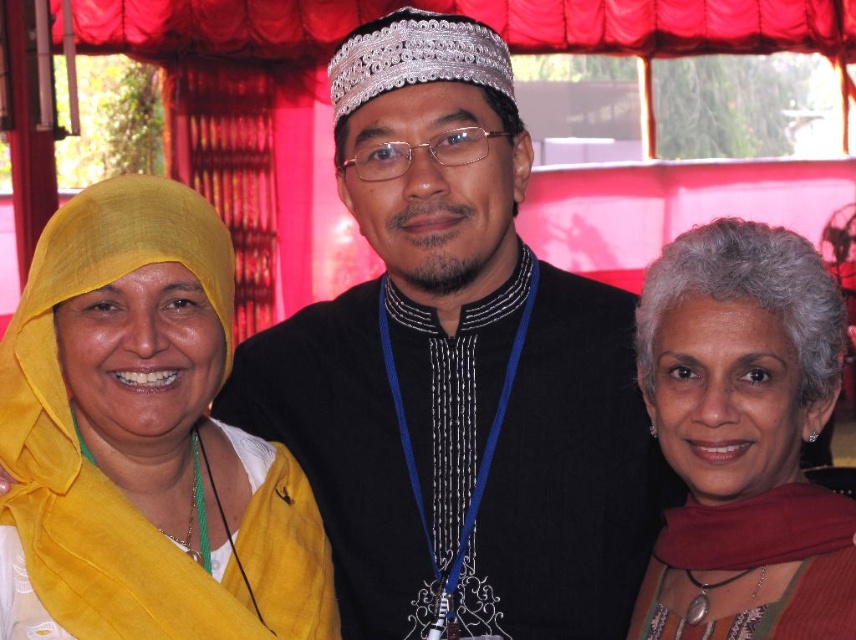
You are organizing a fashion show and need to decide which garment to feature first based on size. Which item should you choose between the black fabric at center and the matte red scarf at right?

The black fabric at center is bigger than the matte red scarf at right, so you should choose the black fabric at center to feature first based on size.

You are standing in front of the scene and want to touch the black fabric at center and the matte red scarf at right. Which object will your hand reach first?

The black fabric at center will be reached first because it is closer to you than the matte red scarf at right.

Based on the scene description, which scarf, the matte yellow scarf at left or the matte red scarf at right, is positioned lower in the image?

The matte yellow scarf at left is positioned below the matte red scarf at right, so the matte yellow scarf at left is lower.